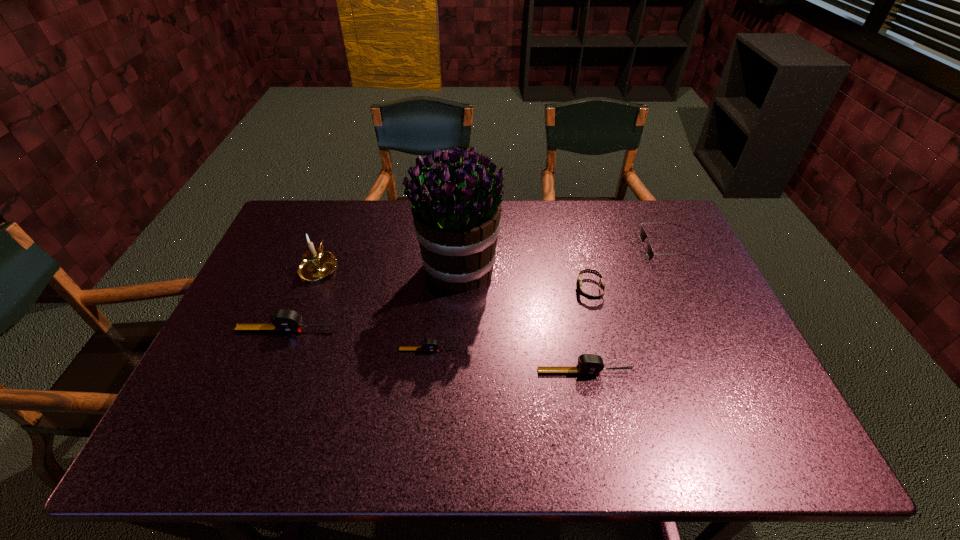
You are a GUI agent. You are given a task and a screenshot of the screen. Output one action in this format:
    pyautogui.click(x=<x>, y=<y>)
    Task: Click on the free space located 0.190m on the back of the fifth farthest object
    
    Given the screenshot: What is the action you would take?
    pyautogui.click(x=308, y=275)

Where is `free space located on the left of the shortest tape measure`? This screenshot has width=960, height=540. free space located on the left of the shortest tape measure is located at coordinates (280, 350).

Locate an element on the screen. The image size is (960, 540). free space located 0.160m on the left of the fourth shortest object is located at coordinates (471, 372).

Find the location of a particular element. This screenshot has width=960, height=540. vacant area situated on the left of the tallest object is located at coordinates click(354, 270).

Where is `free space located on the handle side of the candle holder`? free space located on the handle side of the candle holder is located at coordinates (343, 206).

Where is `free location located on the handle side of the candle holder`? free location located on the handle side of the candle holder is located at coordinates (339, 216).

The image size is (960, 540). I want to click on vacant position located 0.080m on the handle side of the candle holder, so click(x=331, y=234).

This screenshot has width=960, height=540. I want to click on blank space located on the face of the watch, so click(478, 289).

Identify the location of blank space located on the face of the watch. This screenshot has width=960, height=540. (475, 289).

Locate an element on the screen. This screenshot has height=540, width=960. free space located 0.080m on the face of the watch is located at coordinates (548, 289).